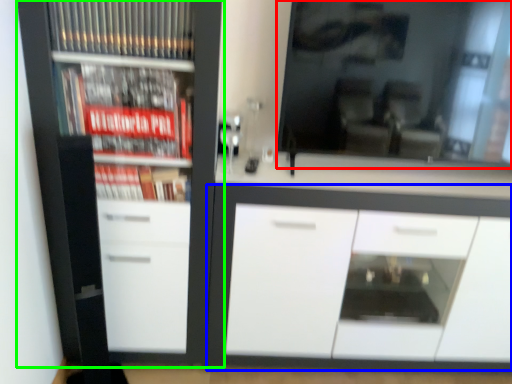
Question: Which object is positioned farthest from mirror (highlighted by a red box)? Select from cabinetry (highlighted by a blue box) and cupboard (highlighted by a green box).

Choices:
 (A) cabinetry
 (B) cupboard

Answer: (B)